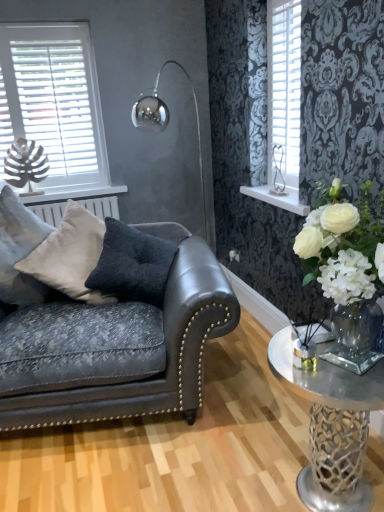
You are a GUI agent. You are given a task and a screenshot of the screen. Output one action in this format:
    pyautogui.click(x=<x>, y=<y>)
    Task: Click on the free spot behind clear glass vase at right
    This screenshot has height=512, width=384.
    Given the screenshot: What is the action you would take?
    click(x=251, y=411)